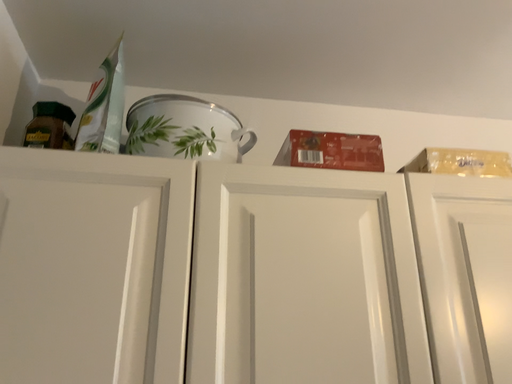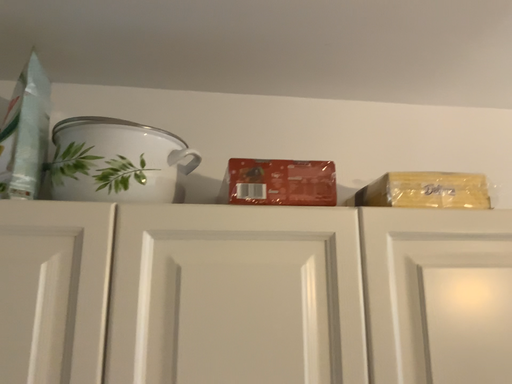
Question: How did the camera likely rotate when shooting the video?

Choices:
 (A) rotated upward
 (B) rotated downward

Answer: (B)